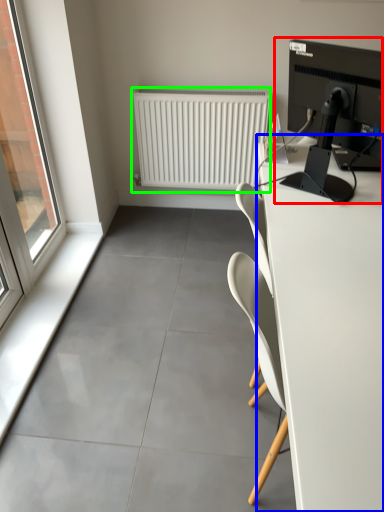
Question: Which is farther away from desktop computer (highlighted by a red box)? desk (highlighted by a blue box) or radiator (highlighted by a green box)?

Choices:
 (A) desk
 (B) radiator

Answer: (B)